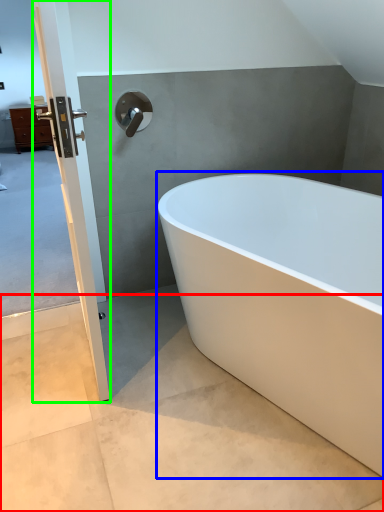
Question: Which object is the farthest from concrete (highlighted by a red box)? Choose among these: bathtub (highlighted by a blue box) or door (highlighted by a green box).

Choices:
 (A) bathtub
 (B) door

Answer: (A)